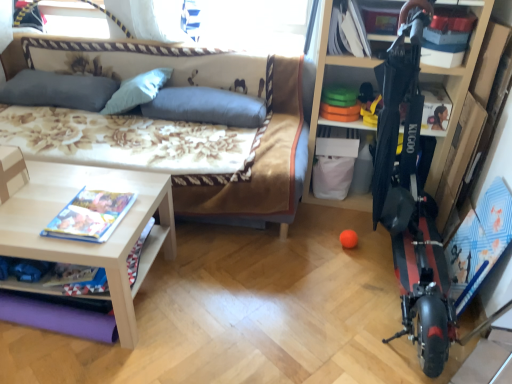
Image resolution: width=512 pixels, height=384 pixels. Find the location of `vacant point above light wood/texture table at lower left (from a real-world perspective)`. vacant point above light wood/texture table at lower left (from a real-world perspective) is located at coordinates [67, 203].